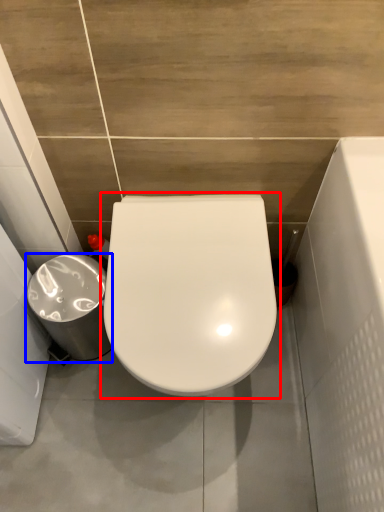
Question: Which object is further to the camera taking this photo, toilet (highlighted by a red box) or porcelain (highlighted by a blue box)?

Choices:
 (A) toilet
 (B) porcelain

Answer: (B)